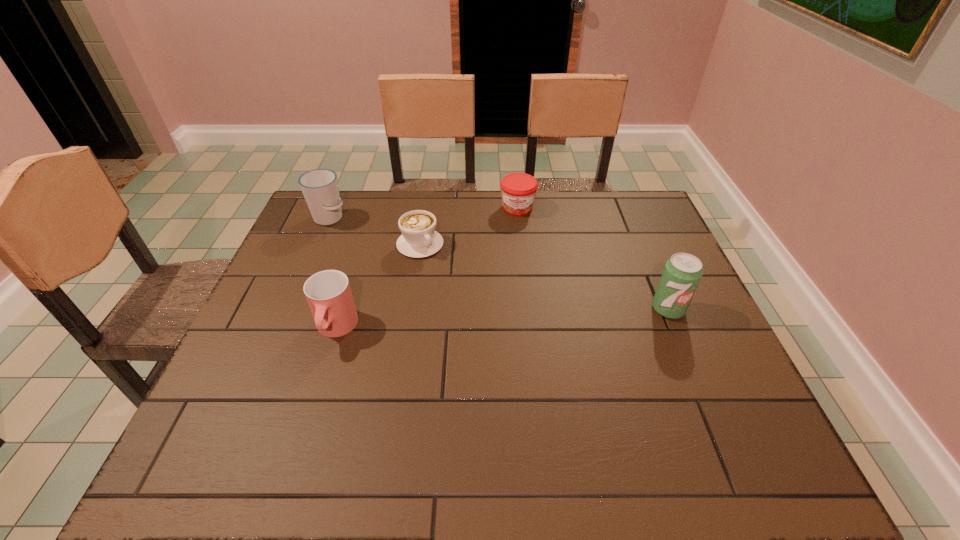
Find the location of a particular element. The height and width of the screenshot is (540, 960). jam present at the far edge is located at coordinates (518, 190).

Locate an element on the screen. The width and height of the screenshot is (960, 540). cup at the far edge is located at coordinates click(x=320, y=188).

In order to click on object present at the right edge in this screenshot , I will do `click(682, 273)`.

Find the location of a particular element. The width and height of the screenshot is (960, 540). object positioned at the far left corner is located at coordinates (320, 188).

Locate an element on the screen. Image resolution: width=960 pixels, height=540 pixels. free space at the far edge of the desktop is located at coordinates (566, 210).

You are a GUI agent. You are given a task and a screenshot of the screen. Output one action in this format:
    pyautogui.click(x=<x>, y=<y>)
    Task: Click on the vacant space at the near edge
    This screenshot has height=540, width=960.
    Given the screenshot: What is the action you would take?
    pyautogui.click(x=593, y=395)

In the image, there is a desktop. Identify the location of vacant space at the right edge. The height and width of the screenshot is (540, 960). (698, 320).

The height and width of the screenshot is (540, 960). I want to click on blank space at the far left corner, so click(311, 220).

In order to click on free location at the far right corner of the desktop in this screenshot , I will do `click(608, 211)`.

Locate an element on the screen. blank space at the near right corner of the desktop is located at coordinates (681, 392).